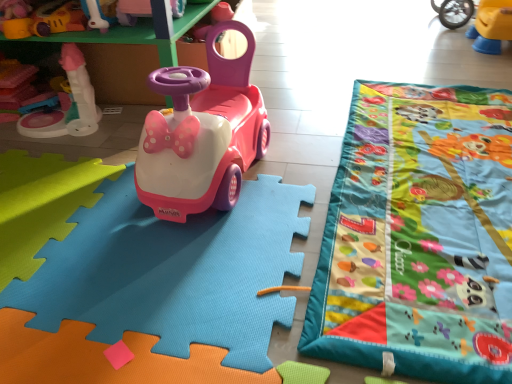
Locate an element on the screen. vacant area situated below pink plastic car at center, the 1th toy ordered from the bottom (from a real-world perspective) is located at coordinates (152, 258).